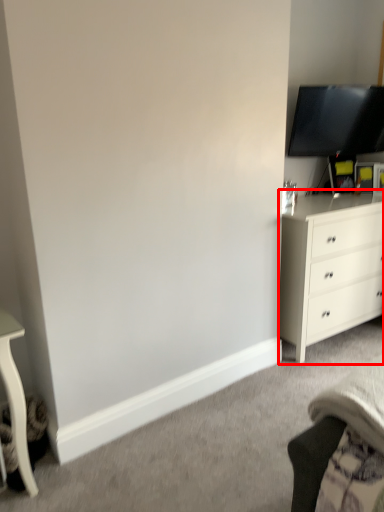
Question: Where is chest of drawers (annotated by the red box) located in relation to television in the image?

Choices:
 (A) right
 (B) left

Answer: (B)